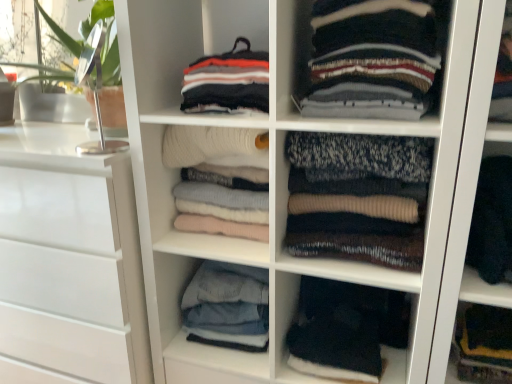
This screenshot has width=512, height=384. What do you see at coordinates (358, 197) in the screenshot?
I see `knit sweater at center, the 3th clothing in the right-to-left sequence` at bounding box center [358, 197].

Describe the element at coordinates (70, 257) in the screenshot. I see `white glossy chest of drawers at left` at that location.

This screenshot has height=384, width=512. Describe the element at coordinates (371, 59) in the screenshot. I see `striped wool sweater at center, the 5th clothing viewed from the left` at that location.

How much space does dark wool sweater at right, placed as the 1th clothing when sorted from right to left, occupy vertically?

8.68 inches.

What is the approximate width of striped cotton sweater at upper center, positioned as the 3th clothing in left-to-right order?

10.92 inches.

Find the location of a particular element. denim jeans at center, arranged as the 1th clothing when viewed from the left is located at coordinates (228, 306).

What is the approximate width of denim jeans at center, arranged as the 1th clothing when viewed from the left?

The width of denim jeans at center, arranged as the 1th clothing when viewed from the left, is 10.92 inches.

You are a GUI agent. You are given a task and a screenshot of the screen. Output one action in this format:
    pyautogui.click(x=<x>, y=<y>)
    Task: Click on the black knitwear at lower center
    The image size is (512, 384).
    Given the screenshot: What is the action you would take?
    pyautogui.click(x=287, y=328)

Considering the positions of objects dark wool sweater at right, placed as the 1th clothing when sorted from right to left, and soft white sweater at center, which appears as the fifth clothing when viewed from the right, in the image provided, who is more to the left, dark wool sweater at right, placed as the 1th clothing when sorted from right to left, or soft white sweater at center, which appears as the fifth clothing when viewed from the right,?

soft white sweater at center, which appears as the fifth clothing when viewed from the right.

Does point (490, 160) come farther from viewer compared to point (240, 201)?

No, it is not.

Measure the distance between dark wool sweater at right, the 6th clothing from the left, and soft white sweater at center, which is counted as the second clothing, starting from the left.

dark wool sweater at right, the 6th clothing from the left, is 24.05 inches away from soft white sweater at center, which is counted as the second clothing, starting from the left.

Looking at this image, between dark wool sweater at right, the 6th clothing from the left, and soft white sweater at center, which is counted as the second clothing, starting from the left, which one has larger width?

dark wool sweater at right, the 6th clothing from the left, is wider.

Considering their positions, is soft white sweater at center, which is counted as the second clothing, starting from the left, located in front of or behind striped cotton sweater at upper center, placed as the 4th clothing when sorted from right to left?

soft white sweater at center, which is counted as the second clothing, starting from the left, is positioned farther from the viewer than striped cotton sweater at upper center, placed as the 4th clothing when sorted from right to left.

Which object is positioned more to the left, soft white sweater at center, which appears as the fifth clothing when viewed from the right, or striped cotton sweater at upper center, placed as the 4th clothing when sorted from right to left?

soft white sweater at center, which appears as the fifth clothing when viewed from the right.

Can you confirm if soft white sweater at center, which is counted as the second clothing, starting from the left, is shorter than striped cotton sweater at upper center, placed as the 4th clothing when sorted from right to left?

No, soft white sweater at center, which is counted as the second clothing, starting from the left, is not shorter than striped cotton sweater at upper center, placed as the 4th clothing when sorted from right to left.

From the image's perspective, which object appears higher, soft white sweater at center, which is counted as the second clothing, starting from the left, or striped cotton sweater at upper center, positioned as the 3th clothing in left-to-right order?

striped cotton sweater at upper center, positioned as the 3th clothing in left-to-right order.

Is point (90, 276) closer or farther from the camera than point (502, 270)?

Point (90, 276) is positioned farther from the camera compared to point (502, 270).

Is dark wool sweater at right, the 6th clothing from the left, at the back of white glossy chest of drawers at left?

white glossy chest of drawers at left does not have its back to dark wool sweater at right, the 6th clothing from the left.

Which is more to the right, white glossy chest of drawers at left or dark wool sweater at right, the 6th clothing from the left?

dark wool sweater at right, the 6th clothing from the left, is more to the right.

How many degrees apart are the facing directions of white glossy chest of drawers at left and dark wool sweater at right, the 6th clothing from the left?

The facing directions of white glossy chest of drawers at left and dark wool sweater at right, the 6th clothing from the left, are 1.62 degrees apart.

Who is smaller, soft white sweater at center, which appears as the fifth clothing when viewed from the right, or dark wool sweater at right, the 6th clothing from the left?

Smaller between the two is dark wool sweater at right, the 6th clothing from the left.

Between soft white sweater at center, which is counted as the second clothing, starting from the left, and dark wool sweater at right, the 6th clothing from the left, which one is positioned in front?

dark wool sweater at right, the 6th clothing from the left.

Is soft white sweater at center, which appears as the fifth clothing when viewed from the right, far away from dark wool sweater at right, placed as the 1th clothing when sorted from right to left?

No, soft white sweater at center, which appears as the fifth clothing when viewed from the right, is in close proximity to dark wool sweater at right, placed as the 1th clothing when sorted from right to left.

Choose the correct answer: Is soft white sweater at center, which appears as the fifth clothing when viewed from the right, inside dark wool sweater at right, placed as the 1th clothing when sorted from right to left, or outside it?

soft white sweater at center, which appears as the fifth clothing when viewed from the right, cannot be found inside dark wool sweater at right, placed as the 1th clothing when sorted from right to left.

Based on their sizes in the image, would you say black knitwear at lower center is bigger or smaller than striped cotton sweater at upper center, positioned as the 3th clothing in left-to-right order?

Considering their sizes, black knitwear at lower center takes up more space than striped cotton sweater at upper center, positioned as the 3th clothing in left-to-right order.

From a real-world perspective, is black knitwear at lower center physically below striped cotton sweater at upper center, positioned as the 3th clothing in left-to-right order?

Yes, from a real-world perspective, black knitwear at lower center is under striped cotton sweater at upper center, positioned as the 3th clothing in left-to-right order.

Are black knitwear at lower center and striped cotton sweater at upper center, positioned as the 3th clothing in left-to-right order, far apart?

Actually, black knitwear at lower center and striped cotton sweater at upper center, positioned as the 3th clothing in left-to-right order, are a little close together.

Is black knitwear at lower center oriented towards striped cotton sweater at upper center, positioned as the 3th clothing in left-to-right order?

No.

Considering the sizes of white glossy chest of drawers at left and striped wool sweater at center, which appears as the 2th clothing when viewed from the right, in the image, is white glossy chest of drawers at left bigger or smaller than striped wool sweater at center, which appears as the 2th clothing when viewed from the right,?

Considering their sizes, white glossy chest of drawers at left takes up more space than striped wool sweater at center, which appears as the 2th clothing when viewed from the right.

Is white glossy chest of drawers at left to the left or to the right of striped wool sweater at center, the 5th clothing viewed from the left, in the image?

From the image, it's evident that white glossy chest of drawers at left is to the left of striped wool sweater at center, the 5th clothing viewed from the left.

Considering the relative positions of white glossy chest of drawers at left and striped wool sweater at center, which appears as the 2th clothing when viewed from the right, in the image provided, is white glossy chest of drawers at left in front of striped wool sweater at center, which appears as the 2th clothing when viewed from the right,?

No.

From a real-world perspective, is white glossy chest of drawers at left physically located above or below striped wool sweater at center, which appears as the 2th clothing when viewed from the right?

From a real-world perspective, white glossy chest of drawers at left is physically below striped wool sweater at center, which appears as the 2th clothing when viewed from the right.

The width and height of the screenshot is (512, 384). In the image, there is a striped wool sweater at center, which appears as the 2th clothing when viewed from the right. In order to click on the chest of drawers below it (from a real-world perspective) in this screenshot , I will do `click(70, 257)`.

From the image's perspective, does striped wool sweater at center, the 5th clothing viewed from the left, appear lower than white glossy chest of drawers at left?

Incorrect, from the image's perspective, striped wool sweater at center, the 5th clothing viewed from the left, is higher than white glossy chest of drawers at left.

Relative to white glossy chest of drawers at left, is striped wool sweater at center, which appears as the 2th clothing when viewed from the right, in front or behind?

Clearly, striped wool sweater at center, which appears as the 2th clothing when viewed from the right, is in front of white glossy chest of drawers at left.

From a real-world perspective, which object stands above the other?

striped wool sweater at center, the 5th clothing viewed from the left.

From the image's perspective, count 2nd clothings downward from the soft white sweater at center, which is counted as the second clothing, starting from the left, and point to it. Please provide its 2D coordinates.

[(492, 221)]

Image resolution: width=512 pixels, height=384 pixels. There is a soft white sweater at center, which appears as the fifth clothing when viewed from the right. What are the coordinates of `the 2nd clothing above it (from a real-world perspective)` in the screenshot? It's located at (227, 82).

Estimate the real-world distances between objects in this image. Which object is closer to denim jeans at center, positioned as the 6th clothing in right-to-left order, dark wool sweater at right, the 6th clothing from the left, or striped wool sweater at center, which appears as the 2th clothing when viewed from the right?

The object closer to denim jeans at center, positioned as the 6th clothing in right-to-left order, is striped wool sweater at center, which appears as the 2th clothing when viewed from the right.

Looking at the image, which one is located further to striped wool sweater at center, the 5th clothing viewed from the left, dark wool sweater at right, the 6th clothing from the left, or white glossy chest of drawers at left?

white glossy chest of drawers at left is further to striped wool sweater at center, the 5th clothing viewed from the left.

Considering their positions, is striped wool sweater at center, the 5th clothing viewed from the left, positioned further to denim jeans at center, arranged as the 1th clothing when viewed from the left, than striped cotton sweater at upper center, placed as the 4th clothing when sorted from right to left?

striped wool sweater at center, the 5th clothing viewed from the left.

When comparing their distances from white glossy chest of drawers at left, does striped wool sweater at center, which appears as the 2th clothing when viewed from the right, or black knitwear at lower center seem further?

striped wool sweater at center, which appears as the 2th clothing when viewed from the right, lies further to white glossy chest of drawers at left than the other object.

From the image, which object appears to be nearer to black knitwear at lower center, soft white sweater at center, which appears as the fifth clothing when viewed from the right, or white glossy chest of drawers at left?

soft white sweater at center, which appears as the fifth clothing when viewed from the right, lies closer to black knitwear at lower center than the other object.

Which object lies nearer to the anchor point black knitwear at lower center, dark wool sweater at right, the 6th clothing from the left, or knit sweater at center, the 3th clothing in the right-to-left sequence?

knit sweater at center, the 3th clothing in the right-to-left sequence, is positioned closer to the anchor black knitwear at lower center.

Consider the image. Based on their spatial positions, is striped wool sweater at center, the 5th clothing viewed from the left, or knit sweater at center, the 3th clothing in the right-to-left sequence, further from soft white sweater at center, which appears as the fifth clothing when viewed from the right?

striped wool sweater at center, the 5th clothing viewed from the left, is positioned further to the anchor soft white sweater at center, which appears as the fifth clothing when viewed from the right.

Based on their spatial positions, is black knitwear at lower center or white glossy chest of drawers at left further from knit sweater at center, the 3th clothing in the right-to-left sequence?

The object further to knit sweater at center, the 3th clothing in the right-to-left sequence, is white glossy chest of drawers at left.

Identify the location of clothing situated between soft white sweater at center, which appears as the fifth clothing when viewed from the right, and knit sweater at center, the 3th clothing in the right-to-left sequence, from left to right. (227, 82).

This screenshot has width=512, height=384. I want to click on shelf located between soft white sweater at center, which appears as the fifth clothing when viewed from the right, and dark wool sweater at right, the 6th clothing from the left, in the left-right direction, so click(287, 328).

You are a GUI agent. You are given a task and a screenshot of the screen. Output one action in this format:
    pyautogui.click(x=<x>, y=<y>)
    Task: Click on the clothing between white glossy chest of drawers at left and soft white sweater at center, which is counted as the second clothing, starting from the left, in the horizontal direction
    This screenshot has width=512, height=384.
    Given the screenshot: What is the action you would take?
    pyautogui.click(x=228, y=306)

At what (x,y) coordinates should I click in order to perform the action: click on shelf between white glossy chest of drawers at left and dark wool sweater at right, placed as the 1th clothing when sorted from right to left, in the horizontal direction. Please return your answer as a coordinate pair (x, y). Looking at the image, I should click on (287, 328).